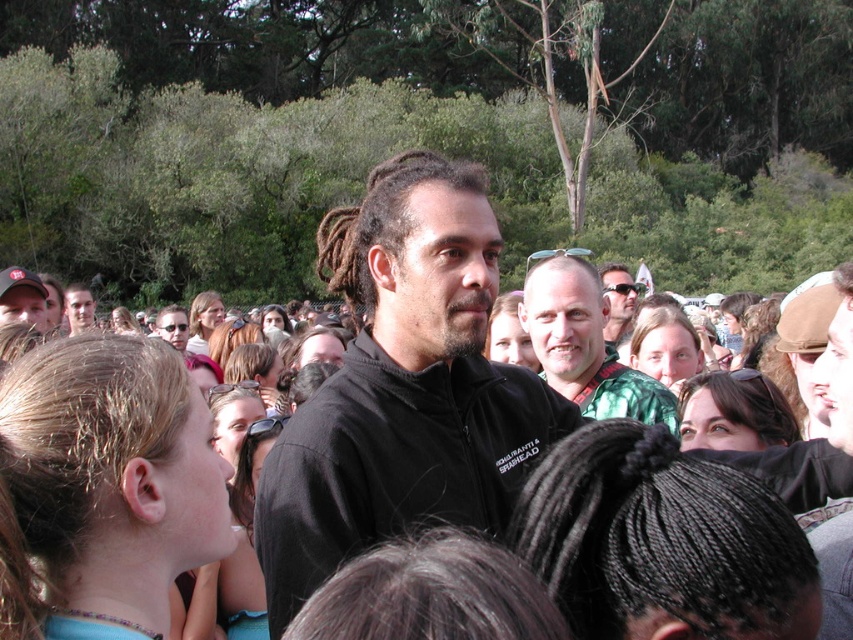
You are a photographer standing at the edge of the crowd, wanting to capture a clear photo of the central man. The black matte jacket at center and the matte black sunglasses at center are both in your view. Given that your camera has a minimum focus distance of 10 feet, will you be able to focus on the central man without moving closer?

The distance between the black matte jacket at center and the matte black sunglasses at center is 9.63 feet, which is less than the camera minimum focus distance of 10 feet. Therefore, the photographer cannot focus on the central man without moving closer.

You are at an event in a park and see a man with dreadlocks wearing a black zip jacket. There is a point marked at coordinates (22,298). What object is located at that point?

The point at (22,298) marks the matte black cap at upper left.